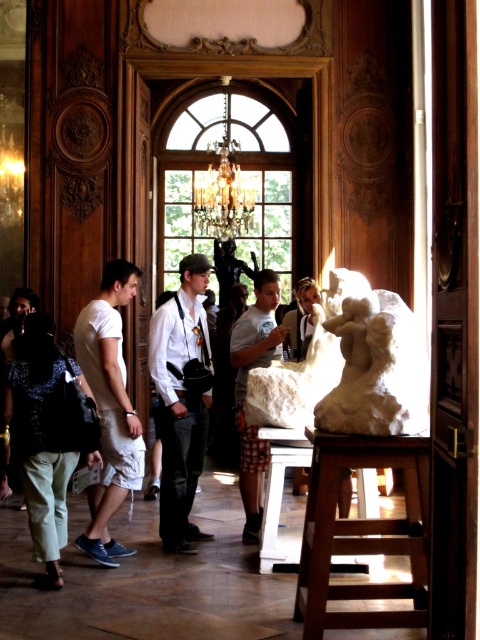
Between point (288, 412) and point (8, 429), which one is positioned in front?

Point (288, 412)

Is white marble statue at center closer to camera compared to denim pants at lower left?

Yes.

You are a GUI agent. You are given a task and a screenshot of the screen. Output one action in this format:
    pyautogui.click(x=<x>, y=<y>)
    Task: Click on the white marble statue at center
    
    Given the screenshot: What is the action you would take?
    pyautogui.click(x=350, y=369)

I want to click on white marble statue at center, so click(350, 369).

Which is below, white marble statue at center or light brown leather jacket at center?

white marble statue at center is below.

Does white marble statue at center have a smaller size compared to light brown leather jacket at center?

Correct, white marble statue at center occupies less space than light brown leather jacket at center.

The height and width of the screenshot is (640, 480). Find the location of `white marble statue at center`. white marble statue at center is located at coordinates (350, 369).

Does white marble statue at center have a lesser width compared to wooden stool at lower right?

No, white marble statue at center is not thinner than wooden stool at lower right.

Who is more forward, (425, 388) or (389, 584)?

Point (425, 388) is in front.

The image size is (480, 640). I want to click on white marble statue at center, so click(x=350, y=369).

The image size is (480, 640). Find the location of `white marble statue at center`. white marble statue at center is located at coordinates (350, 369).